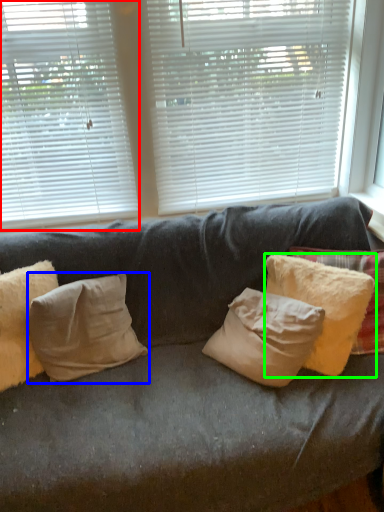
Question: Which object is positioned farthest from window blind (highlighted by a red box)? Select from pillow (highlighted by a blue box) and pillow (highlighted by a green box).

Choices:
 (A) pillow
 (B) pillow

Answer: (B)